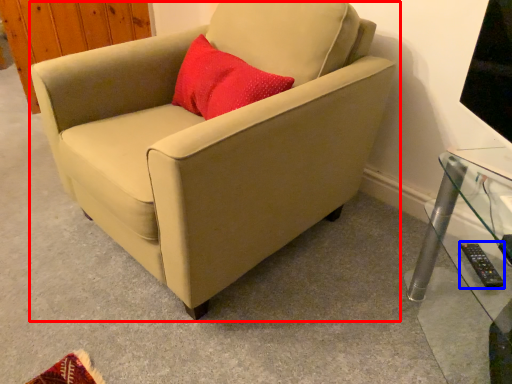
Question: Among these objects, which one is farthest to the camera, chair (highlighted by a red box) or remote (highlighted by a blue box)?

Choices:
 (A) chair
 (B) remote

Answer: (B)